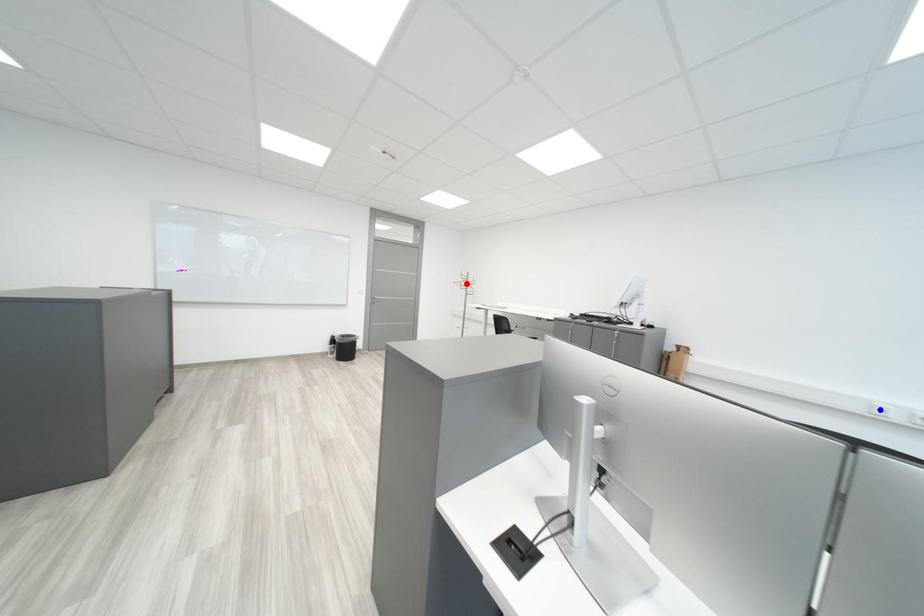
Question: In the image, two points are highlighted. Which point is nearer to the camera? Reply with the corresponding letter.

Choices:
 (A) blue point
 (B) red point

Answer: (A)